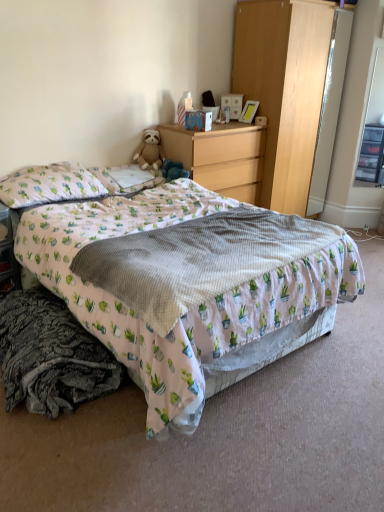
Question: Considering the positions of white textured blanket at center and printed fabric bed at center in the image, is white textured blanket at center taller or shorter than printed fabric bed at center?

Choices:
 (A) tall
 (B) short

Answer: (B)

Question: From a real-world perspective, is white textured blanket at center positioned above or below printed fabric bed at center?

Choices:
 (A) above
 (B) below

Answer: (A)

Question: Which is farther from the white fabric pillow at upper left, which is counted as the 2th pillow, starting from the left?

Choices:
 (A) shiny silver mirror at right
 (B) printed fabric bed at center
 (C) wooden table at lower left
 (D) wooden chest of drawers at center
 (E) transparent plastic drawers at right

Answer: (E)

Question: Which object is the farthest from the light pink fabric pillow at upper left, the second pillow viewed from the right?

Choices:
 (A) wooden chest of drawers at center
 (B) light wood dresser at upper right
 (C) white fabric pillow at upper left, which is counted as the 2th pillow, starting from the left
 (D) matte cardboard box at upper center
 (E) printed fabric bed at center

Answer: (B)